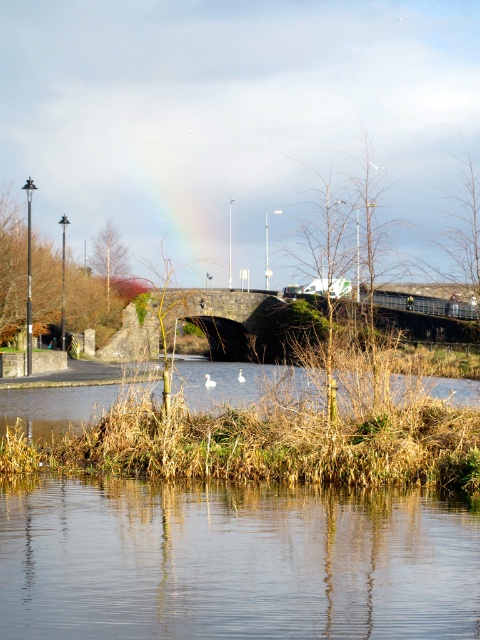
Question: Which object appears farthest from the camera in this image?

Choices:
 (A) brown grassy river at lower center
 (B) transparent water at center

Answer: (A)

Question: Does transparent water at center appear on the right side of brown grassy river at lower center?

Choices:
 (A) yes
 (B) no

Answer: (A)

Question: In this image, where is transparent water at center located relative to brown grassy river at lower center?

Choices:
 (A) right
 (B) left

Answer: (A)

Question: Which point appears closest to the camera in this image?

Choices:
 (A) (39, 609)
 (B) (72, 369)

Answer: (A)

Question: Is transparent water at center further to camera compared to brown grassy river at lower center?

Choices:
 (A) yes
 (B) no

Answer: (B)